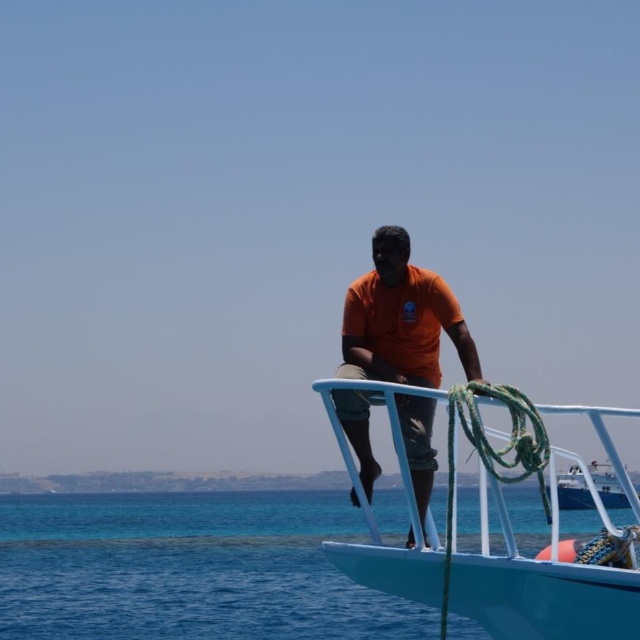
Measure the distance from blue water at lower left to white glossy boat at center.

The distance of blue water at lower left from white glossy boat at center is 48.09 meters.

Can you confirm if blue water at lower left is bigger than white glossy boat at center?

Correct, blue water at lower left is larger in size than white glossy boat at center.

What are the coordinates of `blue water at lower left` in the screenshot? It's located at (189, 570).

Which of these two, blue water at lower left or orange matte shirt at center, stands shorter?

With less height is orange matte shirt at center.

Is blue water at lower left above orange matte shirt at center?

No, blue water at lower left is not above orange matte shirt at center.

Is point (170, 536) less distant than point (346, 420)?

No.

Identify the location of blue water at lower left. The width and height of the screenshot is (640, 640). (189, 570).

Describe the element at coordinates (540, 589) in the screenshot. This screenshot has height=640, width=640. I see `white glossy boat at center` at that location.

Between white glossy boat at center and white glossy boat at right, which one is positioned higher?

white glossy boat at center

Which is in front, point (588, 570) or point (620, 499)?

Point (588, 570) is in front.

The image size is (640, 640). I want to click on white glossy boat at center, so click(540, 589).